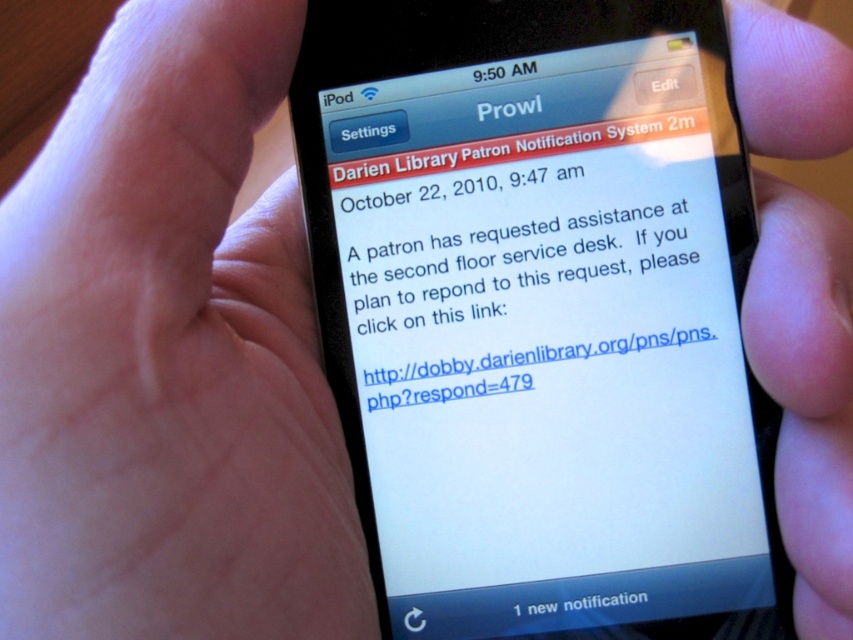
Question: Does white paper text at center appear under white text at bottom?

Choices:
 (A) yes
 (B) no

Answer: (B)

Question: Considering the relative positions of white paper text at center and white text at bottom in the image provided, where is white paper text at center located with respect to white text at bottom?

Choices:
 (A) below
 (B) above

Answer: (B)

Question: Which of the following is the closest to the observer?

Choices:
 (A) (590, 588)
 (B) (621, 401)

Answer: (A)

Question: Which object is farther from the camera taking this photo?

Choices:
 (A) white text at bottom
 (B) white paper text at center

Answer: (B)

Question: Can you confirm if white paper text at center is wider than white text at bottom?

Choices:
 (A) yes
 (B) no

Answer: (A)